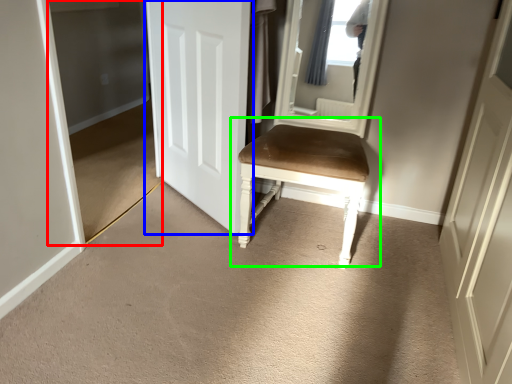
Question: Which object is the closest to the glass door (highlighted by a red box)? Choose among these: door (highlighted by a blue box) or chair (highlighted by a green box).

Choices:
 (A) door
 (B) chair

Answer: (A)